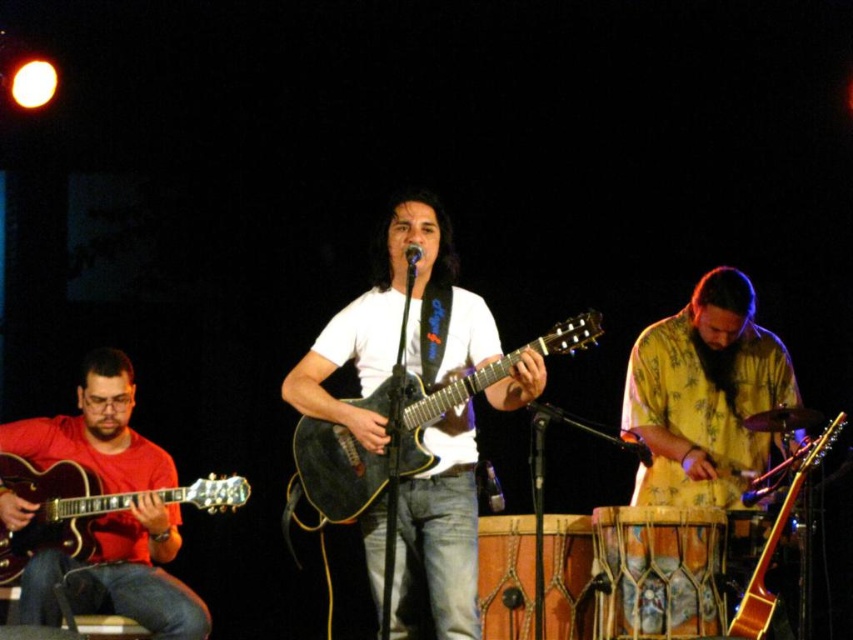
You are a photographer positioned at the back of the stage. You want to capture a photo of both the glossy black guitar at center and the glossy wood guitar at center in the same frame. Which guitar should you adjust your camera angle to focus on first to ensure both are in the frame?

The glossy black guitar at center is to the left of the glossy wood guitar at center. To include both in the frame, focus on the glossy black guitar at center first as it is positioned to the left, allowing the glossy wood guitar at center to be captured to its right.

Based on the photo, you are a photographer in the audience, and you want to take a closeup photo of the matte black guitar at left and the glossy wood guitar at center. Which one will appear larger in your photo?

The matte black guitar at left is closer to the viewer than the glossy wood guitar at center, so it will appear larger in the photo.